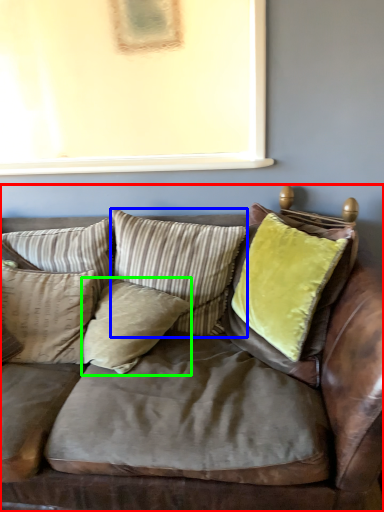
Question: Which object is the closest to the studio couch (highlighted by a red box)? Choose among these: pillow (highlighted by a blue box) or pillow (highlighted by a green box).

Choices:
 (A) pillow
 (B) pillow

Answer: (B)